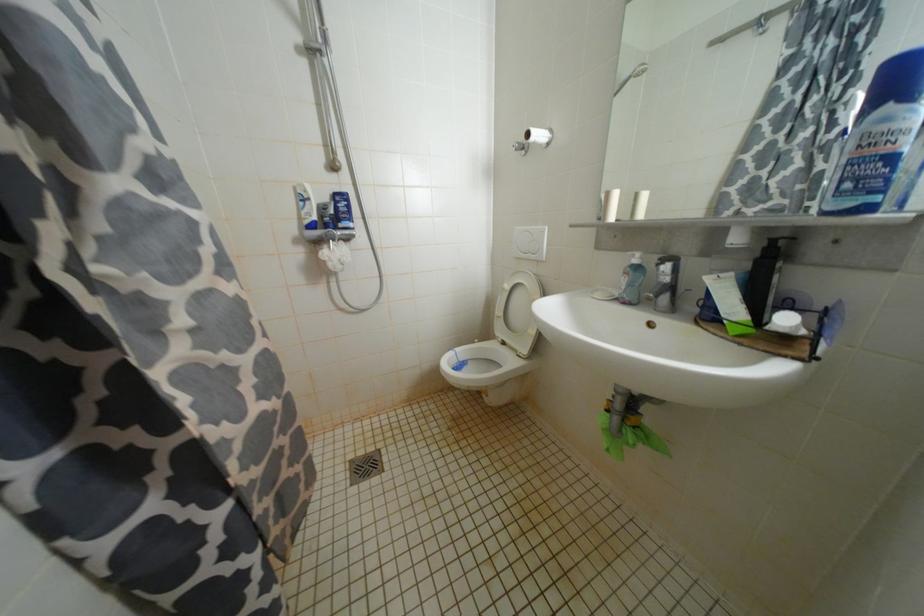
Find the location of a particular element. Image resolution: width=924 pixels, height=616 pixels. white toilet lid is located at coordinates (517, 312).